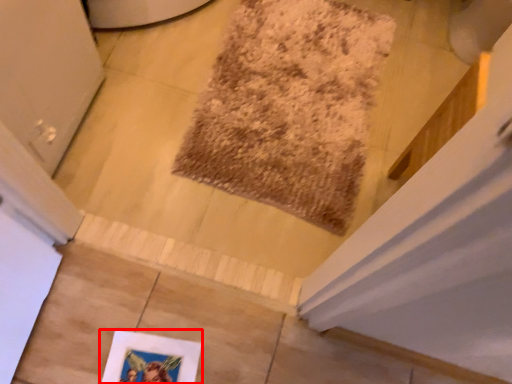
Question: Observing the image, what is the correct spatial positioning of picture frame (annotated by the red box) in reference to mat?

Choices:
 (A) right
 (B) left

Answer: (B)